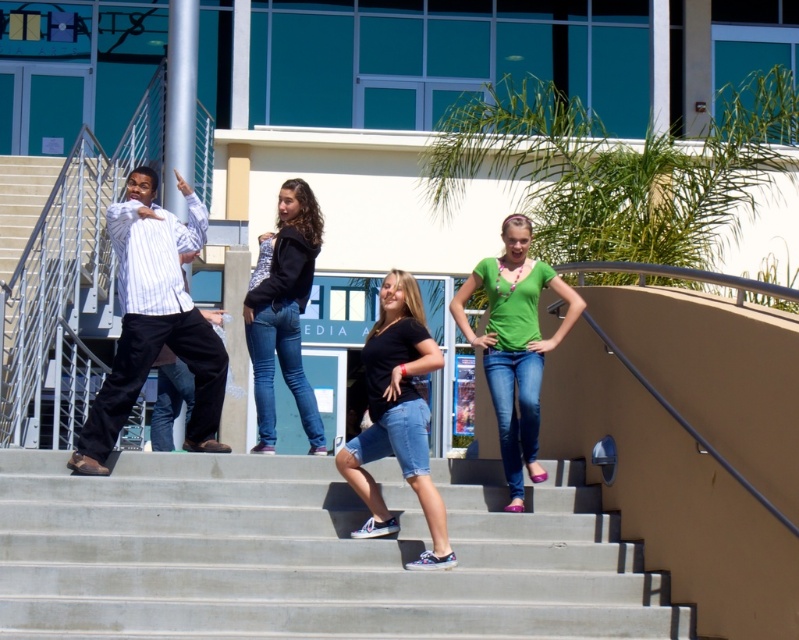
You are standing at the base of the stairs where the group is posing. You need to reach the point marked at coordinates point (654,579). Given that the distance between you and that point is 36.73 feet, can you estimate how many steps you would need to climb to reach it?

The distance between you and the point (654,579) is 36.73 feet. Assuming an average step length of about 2.5 feet, you would need approximately 15 steps to cover that distance.

You are a photographer standing at the base of the stairs. You want to take a photo that includes both the point at (553, 474) and the point at (525, 426). Which point is closer to the camera so you can ensure proper focus?

Point (525, 426) is closer to the camera than point (553, 474), so you should focus on that point first to ensure proper focus.

You are a photographer trying to capture the striped cotton shirt at left and the concrete stairs at center in the same frame. Which object should you focus on first to ensure both are in the shot?

The concrete stairs at center is positioned under the striped cotton shirt at left, so you should focus on the striped cotton shirt at left first to ensure both are in the shot.